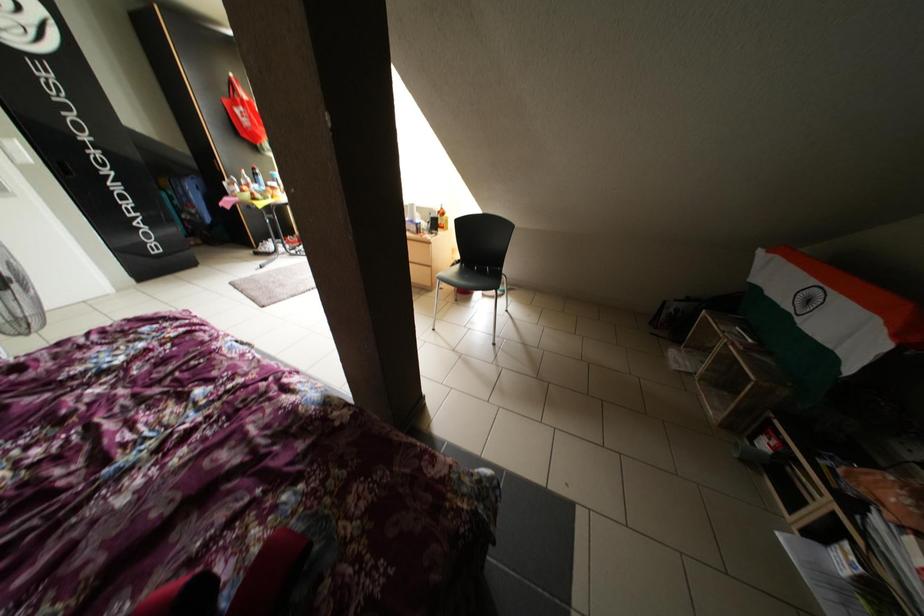
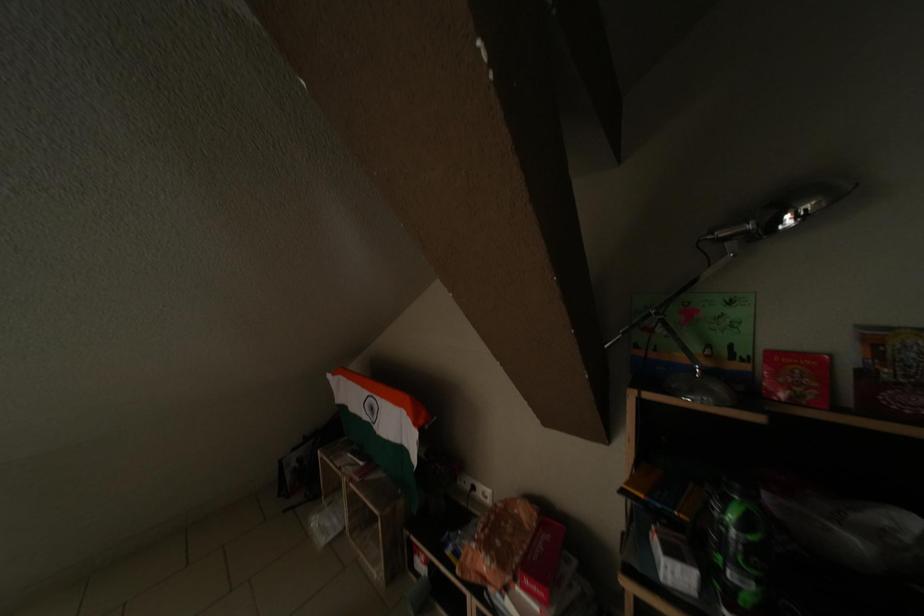
Question: The camera is either moving clockwise (left) or counter-clockwise (right) around the object. The first image is from the beginning of the video and the second image is from the end. Is the camera moving left or right when shooting the video?

Choices:
 (A) Left
 (B) Right

Answer: (A)